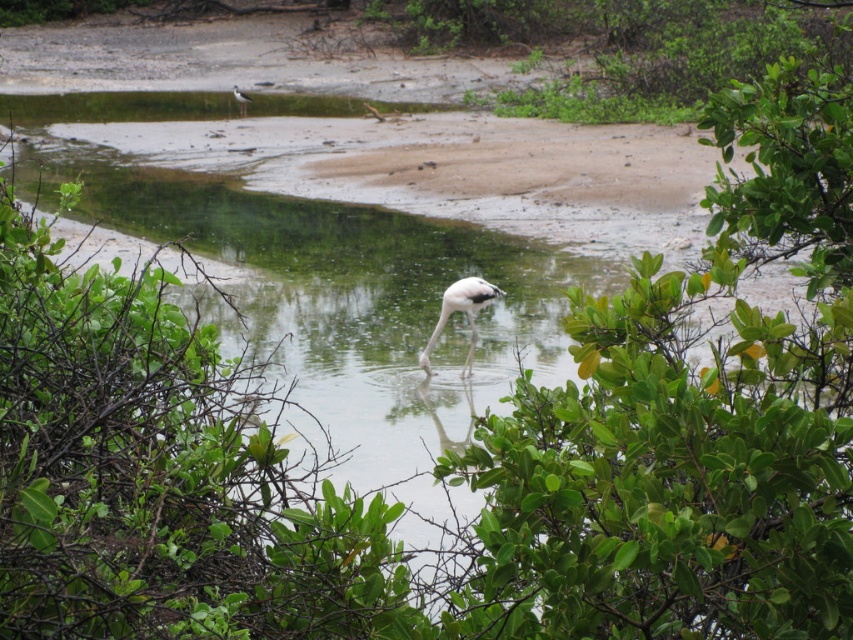
Question: Which object appears farthest from the camera in this image?

Choices:
 (A) white matte flamingo at center
 (B) white matte bird at upper left

Answer: (B)

Question: Does white matte flamingo at center have a larger size compared to white matte bird at upper left?

Choices:
 (A) no
 (B) yes

Answer: (B)

Question: Considering the relative positions of white matte flamingo at center and white matte bird at upper left in the image provided, where is white matte flamingo at center located with respect to white matte bird at upper left?

Choices:
 (A) left
 (B) right

Answer: (B)

Question: Is white matte flamingo at center further to the viewer compared to white matte bird at upper left?

Choices:
 (A) yes
 (B) no

Answer: (B)